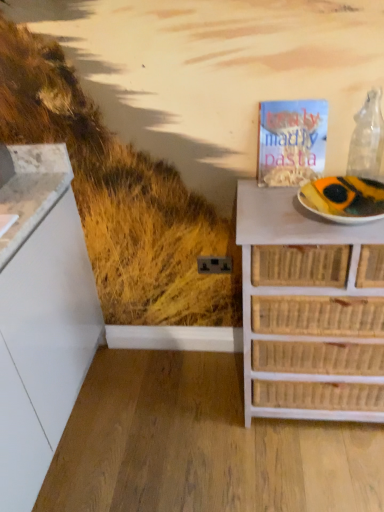
At what (x,y) coordinates should I click in order to perform the action: click on vacant area that is in front of white wicker chest of drawers at right. Please return your answer as a coordinate pair (x, y). Looking at the image, I should click on (316, 471).